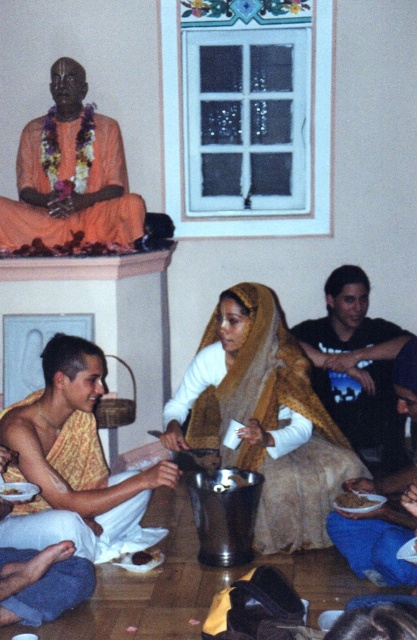
Question: Does orange silk robe at upper left appear over white matte bowl at lower center?

Choices:
 (A) no
 (B) yes

Answer: (B)

Question: Is yellow-orange sari at lower left to the right of brown matte bowl at lower center from the viewer's perspective?

Choices:
 (A) yes
 (B) no

Answer: (B)

Question: Among these points, which one is nearest to the camera?

Choices:
 (A) (359, 500)
 (B) (334, 541)
 (C) (49, 182)
 (D) (24, 486)

Answer: (D)

Question: Which of the following is the closest to the observer?

Choices:
 (A) white matte bowl at lower center
 (B) orange silk robe at upper left
 (C) blue fabric cloth at lower right

Answer: (A)

Question: Is yellow-orange sari at lower left smaller than blue fabric cloth at lower right?

Choices:
 (A) yes
 (B) no

Answer: (B)

Question: Which of the following is the closest to the observer?

Choices:
 (A) orange silk robe at upper left
 (B) white matte bowl at lower center
 (C) yellow-orange sari at lower left

Answer: (B)